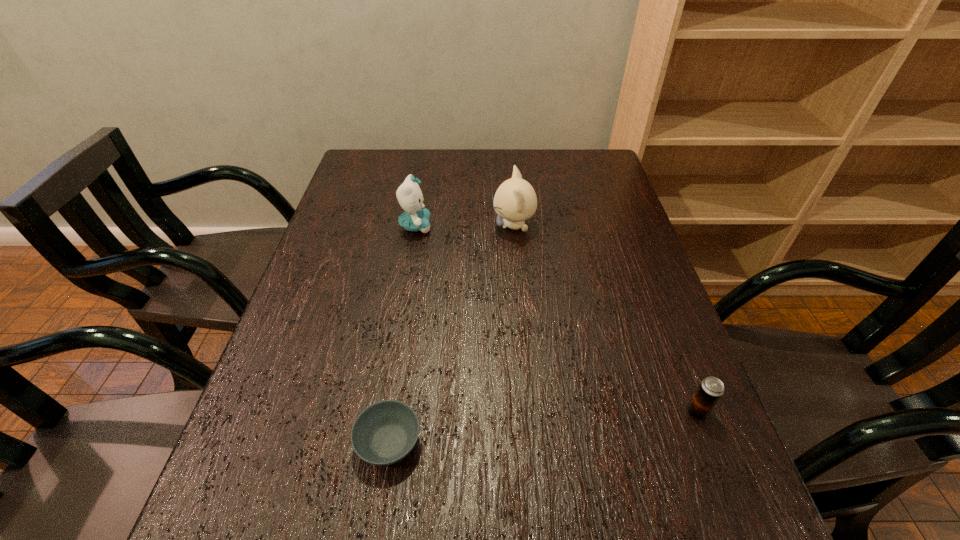
Where is `the third object from left to right`? This screenshot has height=540, width=960. the third object from left to right is located at coordinates (515, 201).

This screenshot has width=960, height=540. I want to click on the left kitten, so click(416, 218).

Find the location of a particular element. The width and height of the screenshot is (960, 540). the rightmost object is located at coordinates (711, 389).

Find the location of a particular element. This screenshot has width=960, height=540. the third tallest object is located at coordinates (711, 389).

Identify the location of soup bowl. The height and width of the screenshot is (540, 960). (384, 433).

Where is `free space located 0.300m on the face of the third object from left to right`? The image size is (960, 540). free space located 0.300m on the face of the third object from left to right is located at coordinates (385, 226).

Where is `free spot located on the face of the third object from left to right`? The image size is (960, 540). free spot located on the face of the third object from left to right is located at coordinates (464, 226).

Identify the location of vacant space located 0.380m on the face of the third object from left to right. (355, 226).

Find the location of a particular element. The width and height of the screenshot is (960, 540). free space located on the face of the left kitten is located at coordinates (522, 226).

You are a GUI agent. You are given a task and a screenshot of the screen. Output one action in this format:
    pyautogui.click(x=<x>, y=<y>)
    Task: Click on the vacant space situated 0.090m on the front of the second shortest object
    
    Given the screenshot: What is the action you would take?
    pyautogui.click(x=720, y=471)